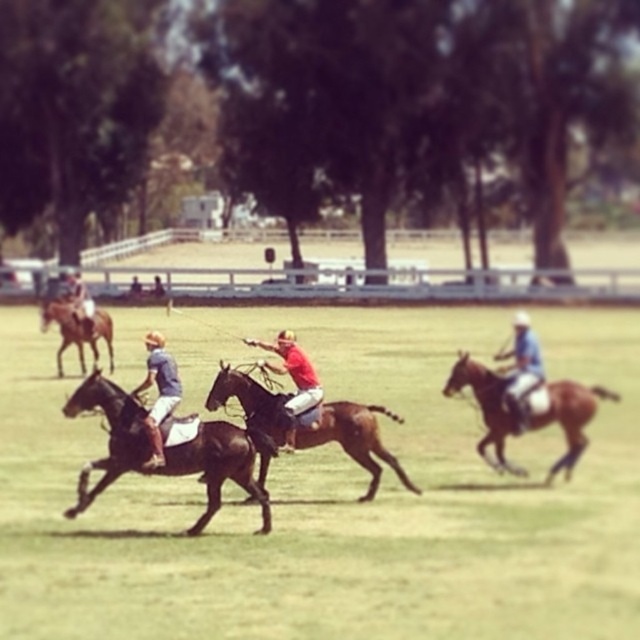
You are a spectator at the polo match and want to take a photo of the matte blue polo shirt at center and the matte black horse at center. Based on their positions, which one should you focus on first to ensure both are in the frame?

The matte blue polo shirt at center is located below the matte black horse at center, so you should focus on the matte black horse at center first to ensure both are in the frame.